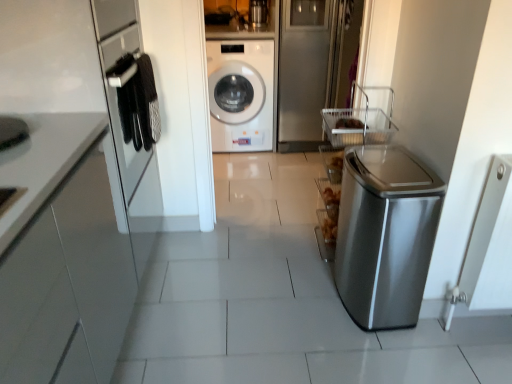
Question: Can brushed metal washing machine at upper center be found inside white glossy washing machine at center?

Choices:
 (A) no
 (B) yes

Answer: (A)

Question: Can you confirm if white glossy washing machine at center is taller than brushed metal washing machine at upper center?

Choices:
 (A) yes
 (B) no

Answer: (A)

Question: Considering the relative sizes of white glossy washing machine at center and brushed metal washing machine at upper center in the image provided, is white glossy washing machine at center shorter than brushed metal washing machine at upper center?

Choices:
 (A) no
 (B) yes

Answer: (A)

Question: Is the depth of white glossy washing machine at center greater than that of brushed metal washing machine at upper center?

Choices:
 (A) yes
 (B) no

Answer: (B)

Question: Considering the relative sizes of white glossy washing machine at center and brushed metal washing machine at upper center in the image provided, is white glossy washing machine at center thinner than brushed metal washing machine at upper center?

Choices:
 (A) no
 (B) yes

Answer: (A)

Question: Visually, is clear glass door at upper center positioned to the left or to the right of satin silver trash can at right?

Choices:
 (A) left
 (B) right

Answer: (A)

Question: From a real-world perspective, is clear glass door at upper center physically located above or below satin silver trash can at right?

Choices:
 (A) below
 (B) above

Answer: (B)

Question: From the image's perspective, relative to satin silver trash can at right, is clear glass door at upper center above or below?

Choices:
 (A) below
 (B) above

Answer: (B)

Question: Is point (333, 8) positioned closer to the camera than point (365, 302)?

Choices:
 (A) farther
 (B) closer

Answer: (A)

Question: Considering their positions, is brushed metal washing machine at upper center located in front of or behind white glossy washing machine at center?

Choices:
 (A) front
 (B) behind

Answer: (B)

Question: Looking at their shapes, would you say brushed metal washing machine at upper center is wider or thinner than white glossy washing machine at center?

Choices:
 (A) wide
 (B) thin

Answer: (B)

Question: From a real-world perspective, is brushed metal washing machine at upper center above or below white glossy washing machine at center?

Choices:
 (A) above
 (B) below

Answer: (A)

Question: Is point (264, 6) closer or farther from the camera than point (258, 127)?

Choices:
 (A) farther
 (B) closer

Answer: (B)

Question: Which is correct: brushed metal washing machine at upper center is inside clear glass door at upper center, or outside of it?

Choices:
 (A) inside
 (B) outside

Answer: (B)

Question: Is brushed metal washing machine at upper center taller or shorter than clear glass door at upper center?

Choices:
 (A) short
 (B) tall

Answer: (A)